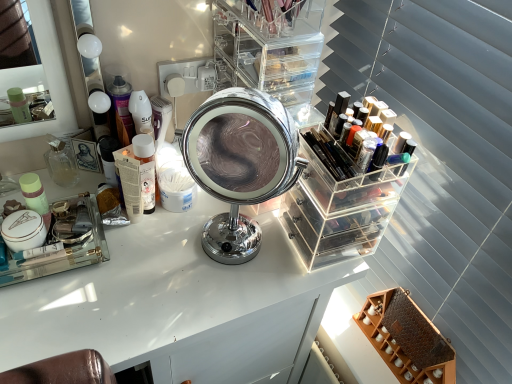
Question: Considering the relative sizes of white glossy table at center and wooden honeycomb-patterned shelf at lower right, which appears as the 1th shelf when viewed from the right, in the image provided, is white glossy table at center smaller than wooden honeycomb-patterned shelf at lower right, which appears as the 1th shelf when viewed from the right,?

Choices:
 (A) no
 (B) yes

Answer: (A)

Question: Is white glossy table at center outside wooden honeycomb-patterned shelf at lower right, which appears as the 1th shelf when viewed from the right?

Choices:
 (A) yes
 (B) no

Answer: (A)

Question: From a real-world perspective, is white glossy table at center below wooden honeycomb-patterned shelf at lower right, acting as the 2th shelf starting from the left?

Choices:
 (A) no
 (B) yes

Answer: (B)

Question: Is white glossy table at center oriented away from wooden honeycomb-patterned shelf at lower right, which appears as the 1th shelf when viewed from the right?

Choices:
 (A) no
 (B) yes

Answer: (A)

Question: Is white glossy table at center at the right side of wooden honeycomb-patterned shelf at lower right, marked as the second shelf in a top-to-bottom arrangement?

Choices:
 (A) yes
 (B) no

Answer: (B)

Question: Considering the relative sizes of white glossy table at center and wooden honeycomb-patterned shelf at lower right, acting as the 2th shelf starting from the left, in the image provided, is white glossy table at center thinner than wooden honeycomb-patterned shelf at lower right, acting as the 2th shelf starting from the left,?

Choices:
 (A) no
 (B) yes

Answer: (A)

Question: Is clear acrylic organizer at center, positioned as the 1th shelf in left-to-right order, not close to shiny black lipstick at upper right, which is counted as the first toiletry, starting from the right?

Choices:
 (A) no
 (B) yes

Answer: (A)

Question: Can you confirm if clear acrylic organizer at center, positioned as the 1th shelf in left-to-right order, is wider than shiny black lipstick at upper right, which is the 3th toiletry from back to front?

Choices:
 (A) yes
 (B) no

Answer: (A)

Question: Considering the relative sizes of clear acrylic organizer at center, which is the second shelf in bottom-to-top order, and shiny black lipstick at upper right, the 1th toiletry viewed from the front, in the image provided, is clear acrylic organizer at center, which is the second shelf in bottom-to-top order, smaller than shiny black lipstick at upper right, the 1th toiletry viewed from the front,?

Choices:
 (A) no
 (B) yes

Answer: (A)

Question: Is clear acrylic organizer at center, positioned as the 1th shelf in left-to-right order, to the right of shiny black lipstick at upper right, which is the 3th toiletry from back to front, from the viewer's perspective?

Choices:
 (A) no
 (B) yes

Answer: (A)

Question: Can you confirm if clear acrylic organizer at center, positioned as the 1th shelf in left-to-right order, is bigger than shiny black lipstick at upper right, which is the 3th toiletry from back to front?

Choices:
 (A) no
 (B) yes

Answer: (B)

Question: Can you confirm if clear acrylic organizer at center, which appears as the first shelf when viewed from the top, is shorter than shiny black lipstick at upper right, which is counted as the third toiletry, starting from the left?

Choices:
 (A) yes
 (B) no

Answer: (B)

Question: Does translucent plastic bottle at left, the 2th toiletry when ordered from front to back, have a larger size compared to translucent glass perfume bottle at left, positioned as the 3th toiletry in right-to-left order?

Choices:
 (A) yes
 (B) no

Answer: (A)